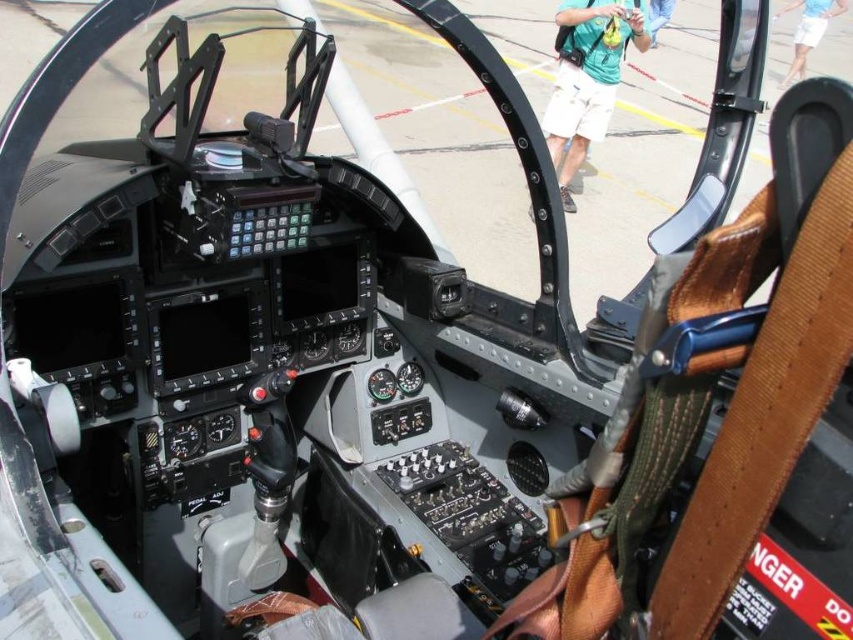
You are a pilot preparing for a mission and need to store your personal items in the cockpit. Given the space available, can the green fabric backpack at upper center fit into the storage compartment designated for the blue cotton shirt at upper right?

The green fabric backpack at upper center occupies less space than the blue cotton shirt at upper right, so it can fit into the storage compartment designated for the blue cotton shirt at upper right.

You are a pilot in the cockpit and need to reach both the point at coordinates point (585, 147) and point (781, 84). Which point should you reach first to minimize the distance traveled?

You should reach point (585, 147) first because it is closer to you than point (781, 84).

Consider the image. You are a pilot preparing for a flight and notice the green fabric backpack at upper center and the blue cotton shirt at upper right in the cockpit. Which item has a smaller width?

The green fabric backpack at upper center has a smaller width than the blue cotton shirt at upper right.